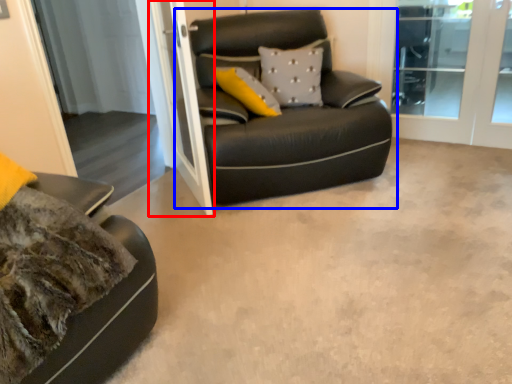
Question: Which object is further to the camera taking this photo, screen door (highlighted by a red box) or studio couch (highlighted by a blue box)?

Choices:
 (A) screen door
 (B) studio couch

Answer: (B)